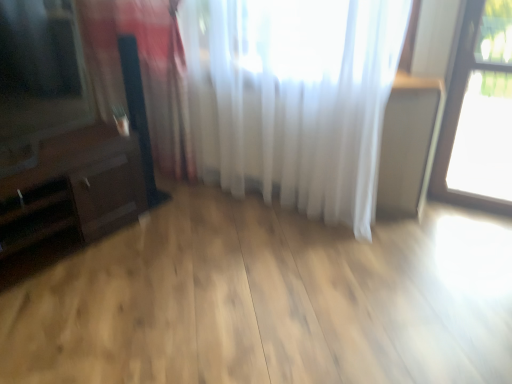
This screenshot has height=384, width=512. Identify the location of spots to the right of dark brown wood dresser at left. (161, 256).